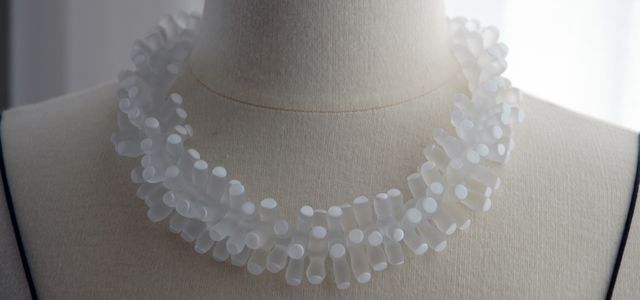
Identify the location of wall. (90, 37).